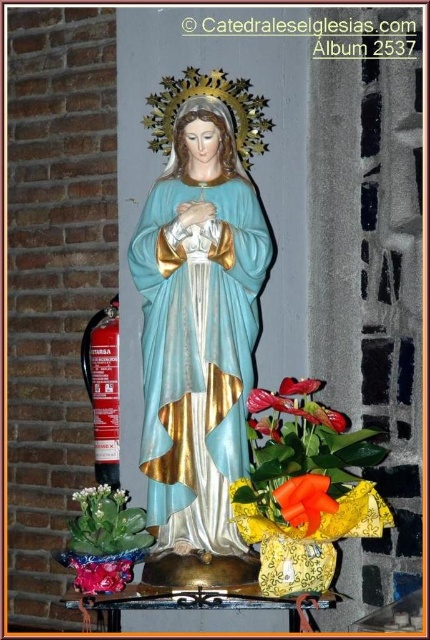
Question: Does matte green succulent at lower left appear on the left side of matte pink petals at lower left?

Choices:
 (A) no
 (B) yes

Answer: (B)

Question: Is matte green succulent at lower left positioned in front of matte orange anthurium at center?

Choices:
 (A) yes
 (B) no

Answer: (B)

Question: Based on their relative distances, which object is farther from the shiny orange ribbon at lower center?

Choices:
 (A) matte green succulent at lower left
 (B) matte blue fabric statue at center

Answer: (A)

Question: Among these points, which one is farthest from the camera?

Choices:
 (A) (280, 401)
 (B) (98, 593)

Answer: (B)

Question: Does matte green succulent at lower left have a larger size compared to matte orange anthurium at center?

Choices:
 (A) no
 (B) yes

Answer: (B)

Question: Which is nearer to the matte pink petals at lower left?

Choices:
 (A) shiny orange ribbon at lower center
 (B) matte green succulent at lower left
 (C) matte orange flower at center

Answer: (B)